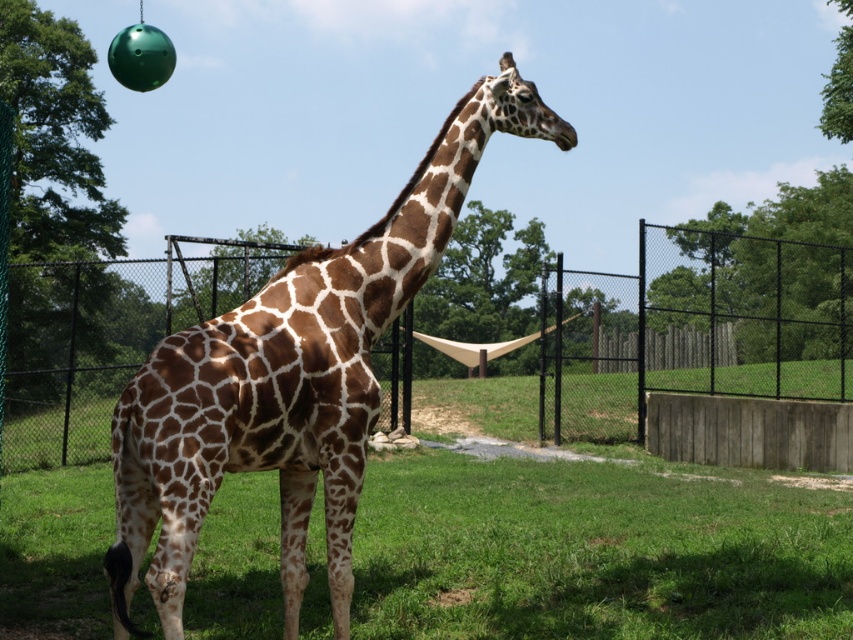
Question: Which of the following is the closest to the observer?

Choices:
 (A) (294, 452)
 (B) (834, 372)

Answer: (A)

Question: Does black metal fence at center come behind brown spotted giraffe at center?

Choices:
 (A) yes
 (B) no

Answer: (A)

Question: Among these objects, which one is nearest to the camera?

Choices:
 (A) brown spotted giraffe at center
 (B) black metal fence at center

Answer: (A)

Question: Is black metal fence at center positioned in front of brown spotted giraffe at center?

Choices:
 (A) yes
 (B) no

Answer: (B)

Question: Is black metal fence at center smaller than brown spotted giraffe at center?

Choices:
 (A) yes
 (B) no

Answer: (B)